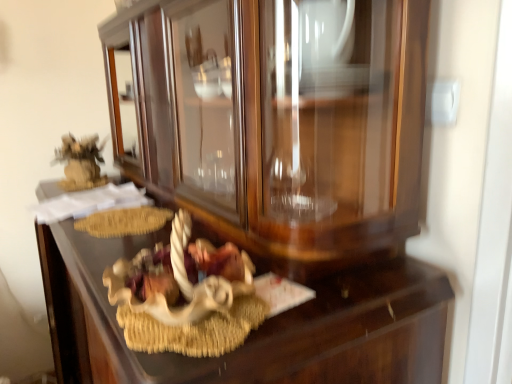
Looking at this image, measure the distance between point (346, 349) and camera.

Point (346, 349) is 68.30 centimeters away from camera.

The image size is (512, 384). In order to click on wooden drawer at center in this screenshot , I will do `click(308, 335)`.

Describe the element at coordinates (308, 335) in the screenshot. The image size is (512, 384). I see `wooden drawer at center` at that location.

You are a GUI agent. You are given a task and a screenshot of the screen. Output one action in this format:
    pyautogui.click(x=<x>, y=<y>)
    Task: Click on the white matte nativity scene at center
    
    Given the screenshot: What is the action you would take?
    pyautogui.click(x=185, y=296)

What do you see at coordinates (185, 296) in the screenshot?
I see `white matte nativity scene at center` at bounding box center [185, 296].

Where is `wooden drawer at center`? wooden drawer at center is located at coordinates (308, 335).

Does wooden drawer at center appear on the right side of white matte nativity scene at center?

In fact, wooden drawer at center is to the left of white matte nativity scene at center.

From the picture: Which object is further away from the camera, wooden drawer at center or white matte nativity scene at center?

white matte nativity scene at center is further away from the camera.

Which point is more distant from viewer, (318, 380) or (188, 313)?

Positioned behind is point (318, 380).

From the image's perspective, is wooden drawer at center located above white matte nativity scene at center?

No.

From a real-world perspective, does wooden drawer at center stand above white matte nativity scene at center?

Actually, wooden drawer at center is physically below white matte nativity scene at center in the real world.

Looking at their sizes, would you say wooden drawer at center is wider or thinner than white matte nativity scene at center?

Clearly, wooden drawer at center has more width compared to white matte nativity scene at center.

In terms of height, does wooden drawer at center look taller or shorter compared to white matte nativity scene at center?

Considering their sizes, wooden drawer at center has more height than white matte nativity scene at center.

Considering the sizes of wooden drawer at center and white matte nativity scene at center in the image, is wooden drawer at center bigger or smaller than white matte nativity scene at center?

Clearly, wooden drawer at center is larger in size than white matte nativity scene at center.

Would you say wooden drawer at center contains white matte nativity scene at center?

That's incorrect, white matte nativity scene at center is not inside wooden drawer at center.

Does wooden drawer at center touch white matte nativity scene at center?

No, wooden drawer at center is not in contact with white matte nativity scene at center.

Does wooden drawer at center turn towards white matte nativity scene at center?

No, wooden drawer at center is not turned towards white matte nativity scene at center.

How many degrees apart are the facing directions of wooden drawer at center and white matte nativity scene at center?

wooden drawer at center and white matte nativity scene at center are facing 1.25 degrees away from each other.

You are a GUI agent. You are given a task and a screenshot of the screen. Output one action in this format:
    pyautogui.click(x=<x>, y=<y>)
    Task: Click on the stuff on the right of wooden drawer at center
    
    Given the screenshot: What is the action you would take?
    pyautogui.click(x=185, y=296)

Based on the photo, between white matte nativity scene at center and wooden drawer at center, which one appears on the right side from the viewer's perspective?

Positioned to the right is white matte nativity scene at center.

In the scene shown: Between white matte nativity scene at center and wooden drawer at center, which one is positioned behind?

white matte nativity scene at center.

Is point (193, 268) farther from viewer compared to point (240, 367)?

Yes, it is behind point (240, 367).

From the image's perspective, which one is positioned lower, white matte nativity scene at center or wooden drawer at center?

wooden drawer at center appears lower in the image.

From a real-world perspective, is white matte nativity scene at center on wooden drawer at center?

Yes, from a real-world perspective, white matte nativity scene at center is on top of wooden drawer at center.

Is white matte nativity scene at center wider or thinner than wooden drawer at center?

In the image, white matte nativity scene at center appears to be more narrow than wooden drawer at center.

Considering the sizes of objects white matte nativity scene at center and wooden drawer at center in the image provided, who is shorter, white matte nativity scene at center or wooden drawer at center?

Standing shorter between the two is white matte nativity scene at center.

Considering the relative sizes of white matte nativity scene at center and wooden drawer at center in the image provided, is white matte nativity scene at center bigger than wooden drawer at center?

Incorrect, white matte nativity scene at center is not larger than wooden drawer at center.

Is wooden drawer at center surrounded by white matte nativity scene at center?

No, wooden drawer at center is located outside of white matte nativity scene at center.

Is white matte nativity scene at center far away from wooden drawer at center?

No.

Is white matte nativity scene at center looking in the opposite direction of wooden drawer at center?

No, white matte nativity scene at center is not facing the opposite direction of wooden drawer at center.

Image resolution: width=512 pixels, height=384 pixels. I want to click on drawer located in front of the white matte nativity scene at center, so click(x=308, y=335).

This screenshot has height=384, width=512. In order to click on drawer in front of the white matte nativity scene at center in this screenshot , I will do `click(308, 335)`.

Where is `stuff above the wooden drawer at center (from the image's perspective)`? This screenshot has height=384, width=512. stuff above the wooden drawer at center (from the image's perspective) is located at coordinates (185, 296).